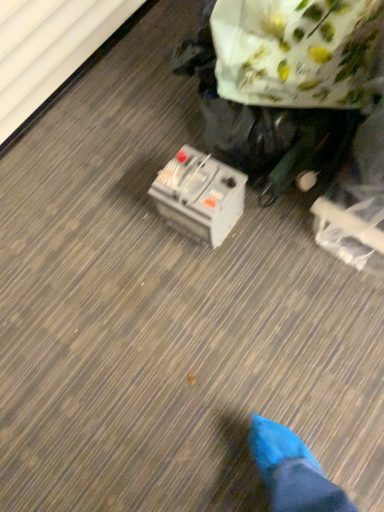
Where is `gray plastic battery at center`? gray plastic battery at center is located at coordinates (199, 196).

Describe the element at coordinates (199, 196) in the screenshot. The image size is (384, 512). I see `gray plastic battery at center` at that location.

Measure the distance between point (x=288, y=84) and camera.

Point (x=288, y=84) and camera are 3.35 feet apart.

The height and width of the screenshot is (512, 384). Describe the element at coordinates (295, 51) in the screenshot. I see `white floral paper bag at upper right` at that location.

Locate an element on the screen. This screenshot has width=384, height=512. white floral paper bag at upper right is located at coordinates (295, 51).

Where is `gray plastic battery at center`? This screenshot has height=512, width=384. gray plastic battery at center is located at coordinates (199, 196).

Considering the positions of objects white floral paper bag at upper right and gray plastic battery at center in the image provided, who is more to the left, white floral paper bag at upper right or gray plastic battery at center?

gray plastic battery at center is more to the left.

Which object is closer to the camera, white floral paper bag at upper right or gray plastic battery at center?

white floral paper bag at upper right.

Does point (338, 57) lie in front of point (213, 230)?

That is True.

From the image's perspective, is white floral paper bag at upper right located above or below gray plastic battery at center?

white floral paper bag at upper right is above gray plastic battery at center.

From a real-world perspective, is white floral paper bag at upper right positioned above or below gray plastic battery at center?

white floral paper bag at upper right is above gray plastic battery at center.

Consider the image. Can you confirm if white floral paper bag at upper right is thinner than gray plastic battery at center?

In fact, white floral paper bag at upper right might be wider than gray plastic battery at center.

Does white floral paper bag at upper right have a lesser height compared to gray plastic battery at center?

In fact, white floral paper bag at upper right may be taller than gray plastic battery at center.

Considering the sizes of white floral paper bag at upper right and gray plastic battery at center in the image, is white floral paper bag at upper right bigger or smaller than gray plastic battery at center?

Clearly, white floral paper bag at upper right is larger in size than gray plastic battery at center.

Could gray plastic battery at center be considered to be inside white floral paper bag at upper right?

Actually, gray plastic battery at center is outside white floral paper bag at upper right.

Would you consider white floral paper bag at upper right to be distant from gray plastic battery at center?

Actually, white floral paper bag at upper right and gray plastic battery at center are a little close together.

Is white floral paper bag at upper right facing towards gray plastic battery at center?

No, white floral paper bag at upper right is not oriented towards gray plastic battery at center.

Where is `equipment lying below the white floral paper bag at upper right (from the image's perspective)`? The height and width of the screenshot is (512, 384). equipment lying below the white floral paper bag at upper right (from the image's perspective) is located at coordinates tap(199, 196).

Which object is positioned more to the right, gray plastic battery at center or white floral paper bag at upper right?

white floral paper bag at upper right is more to the right.

Is gray plastic battery at center behind white floral paper bag at upper right?

Yes.

Which is in front, point (190, 155) or point (310, 49)?

The point (310, 49) is more forward.

From the image's perspective, is gray plastic battery at center above or below white floral paper bag at upper right?

Clearly, from the image's perspective, gray plastic battery at center is below white floral paper bag at upper right.

From a real-world perspective, is gray plastic battery at center positioned over white floral paper bag at upper right based on gravity?

No, from a real-world perspective, gray plastic battery at center is not above white floral paper bag at upper right.

Considering the sizes of gray plastic battery at center and white floral paper bag at upper right in the image, is gray plastic battery at center wider or thinner than white floral paper bag at upper right?

In the image, gray plastic battery at center appears to be more narrow than white floral paper bag at upper right.

Which of these two, gray plastic battery at center or white floral paper bag at upper right, stands shorter?

gray plastic battery at center is shorter.

Is gray plastic battery at center bigger or smaller than white floral paper bag at upper right?

gray plastic battery at center is smaller than white floral paper bag at upper right.

Can we say gray plastic battery at center lies outside white floral paper bag at upper right?

Yes, gray plastic battery at center is outside of white floral paper bag at upper right.

Is gray plastic battery at center directly adjacent to white floral paper bag at upper right?

No, gray plastic battery at center is not with white floral paper bag at upper right.

Does gray plastic battery at center turn towards white floral paper bag at upper right?

No.

Can you tell me how much gray plastic battery at center and white floral paper bag at upper right differ in facing direction?

The angle between the facing direction of gray plastic battery at center and the facing direction of white floral paper bag at upper right is 26.4 degrees.

Locate an element on the screen. paper bag lying in front of the gray plastic battery at center is located at coordinates (295, 51).

You are a GUI agent. You are given a task and a screenshot of the screen. Output one action in this format:
    pyautogui.click(x=<x>, y=<y>)
    Task: Click on the equipment directly beneath the white floral paper bag at upper right (from a real-world perspective)
    This screenshot has height=512, width=384.
    Given the screenshot: What is the action you would take?
    pyautogui.click(x=199, y=196)

At what (x,y) coordinates should I click in order to perform the action: click on equipment on the left side of white floral paper bag at upper right. Please return your answer as a coordinate pair (x, y). The image size is (384, 512). Looking at the image, I should click on (199, 196).